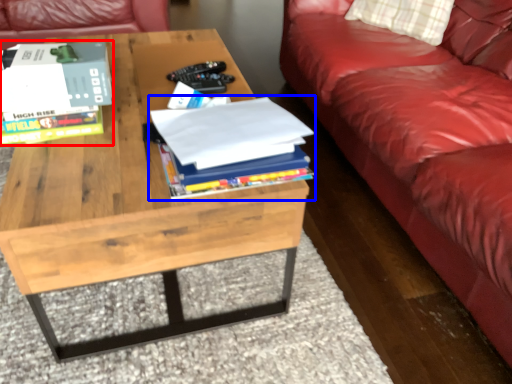
Question: Among these objects, which one is nearest to the camera, book (highlighted by a red box) or book (highlighted by a blue box)?

Choices:
 (A) book
 (B) book

Answer: (B)